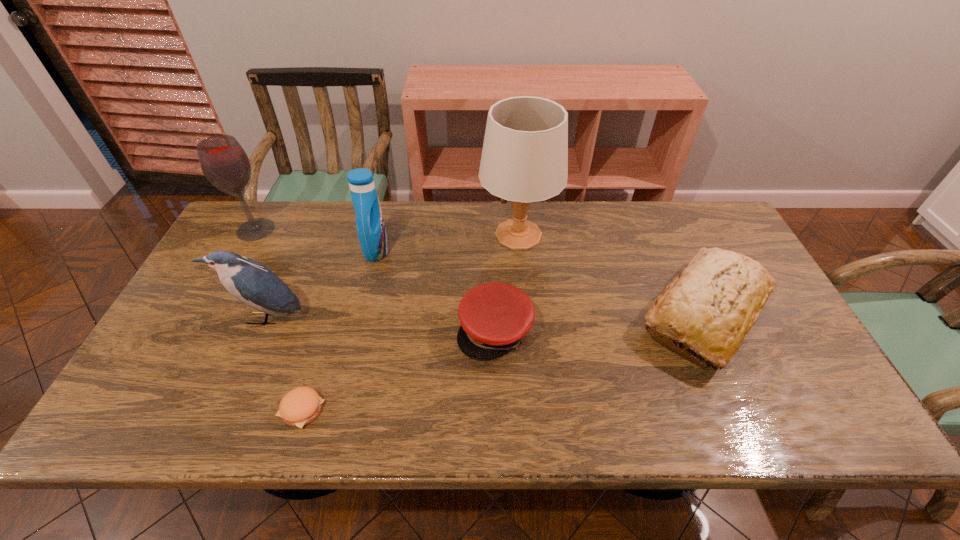
Locate an element on the screen. The height and width of the screenshot is (540, 960). unoccupied area between the nearest object and the alcohol is located at coordinates (278, 320).

Where is `the fourth closest object to the bread`? This screenshot has width=960, height=540. the fourth closest object to the bread is located at coordinates (300, 406).

Select which object is the third closest to the fifth tallest object. Please provide its 2D coordinates. Your answer should be formatted as a tuple, i.e. [(x, y)], where the tuple contains the x and y coordinates of a point satisfying the conditions above.

[(370, 225)]

I want to click on free space that satisfies the following two spatial constraints: 1. on the front side of the table lamp; 2. on the left side of the fifth tallest object, so click(x=526, y=314).

You are a GUI agent. You are given a task and a screenshot of the screen. Output one action in this format:
    pyautogui.click(x=<x>, y=<y>)
    Task: Click on the vacant region that satisfies the following two spatial constraints: 1. on the front side of the alcohol; 2. on the right side of the nearest object
    
    Given the screenshot: What is the action you would take?
    pyautogui.click(x=156, y=410)

At what (x,y) coordinates should I click in order to perform the action: click on free space that satisfies the following two spatial constraints: 1. on the front side of the alcohol; 2. on the right side of the patty. Please return your answer as a coordinate pair (x, y). The height and width of the screenshot is (540, 960). Looking at the image, I should click on (156, 410).

Locate an element on the screen. Image resolution: width=960 pixels, height=540 pixels. vacant space that satisfies the following two spatial constraints: 1. at the tip of the nearest object's beak; 2. on the right side of the bird is located at coordinates (226, 410).

At what (x,y) coordinates should I click in order to perform the action: click on vacant space that satisfies the following two spatial constraints: 1. on the front side of the alcohol; 2. on the left side of the tallest object. Please return your answer as a coordinate pair (x, y). The width and height of the screenshot is (960, 540). Looking at the image, I should click on (252, 235).

Where is `free space that satisfies the following two spatial constraints: 1. on the front side of the table lamp; 2. on the right side of the alcohol`? The height and width of the screenshot is (540, 960). free space that satisfies the following two spatial constraints: 1. on the front side of the table lamp; 2. on the right side of the alcohol is located at coordinates (252, 235).

Where is `free space in the image that satisfies the following two spatial constraints: 1. at the tip of the shortest object's beak; 2. on the left side of the fourth shortest object`? free space in the image that satisfies the following two spatial constraints: 1. at the tip of the shortest object's beak; 2. on the left side of the fourth shortest object is located at coordinates (226, 410).